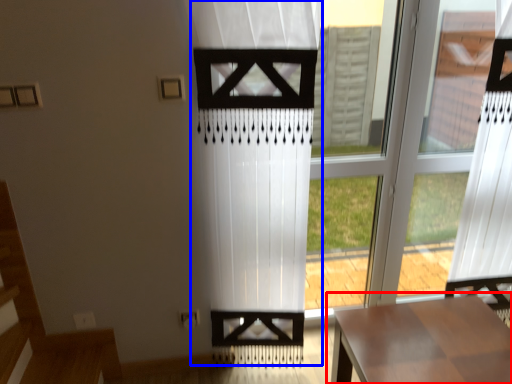
Question: Which object appears closest to the camera in this image, table (highlighted by a red box) or curtain (highlighted by a blue box)?

Choices:
 (A) table
 (B) curtain

Answer: (B)